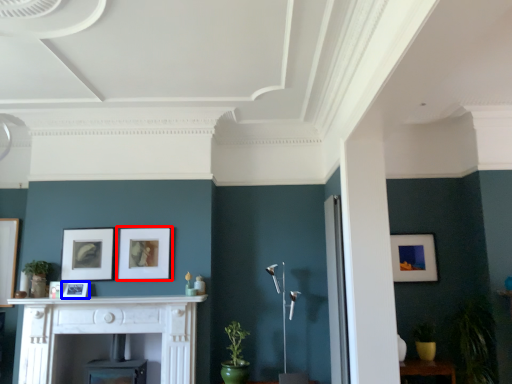
Question: Which of the following is the closest to the observer, picture frame (highlighted by a red box) or picture frame (highlighted by a blue box)?

Choices:
 (A) picture frame
 (B) picture frame

Answer: (B)